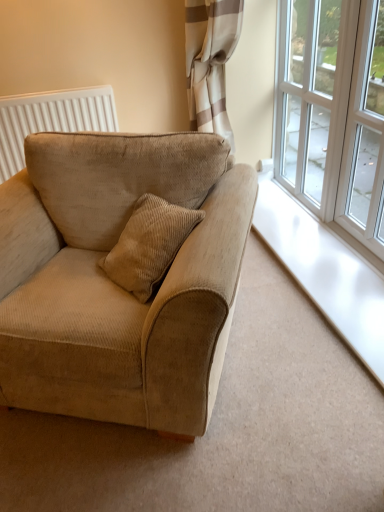
Question: Does beige corduroy couch at left have a greater width compared to clear glass window at upper right, which is the 1th window in front-to-back order?

Choices:
 (A) no
 (B) yes

Answer: (B)

Question: From a real-world perspective, does beige corduroy couch at left stand above clear glass window at upper right, which is counted as the 2th window, starting from the back?

Choices:
 (A) yes
 (B) no

Answer: (B)

Question: Can you confirm if beige corduroy couch at left is positioned to the right of clear glass window at upper right, which is the 1th window in front-to-back order?

Choices:
 (A) yes
 (B) no

Answer: (B)

Question: From a real-world perspective, is beige corduroy couch at left below clear glass window at upper right, which is counted as the 2th window, starting from the back?

Choices:
 (A) yes
 (B) no

Answer: (A)

Question: Is beige corduroy couch at left facing towards clear glass window at upper right, which is the 1th window in front-to-back order?

Choices:
 (A) no
 (B) yes

Answer: (A)

Question: Is beige corduroy couch at left positioned in front of clear glass window at upper right, which is counted as the 2th window, starting from the back?

Choices:
 (A) no
 (B) yes

Answer: (B)

Question: Can you confirm if clear glass window at upper right, which is the 1th window in front-to-back order, is positioned to the left of white textured radiator at upper left?

Choices:
 (A) yes
 (B) no

Answer: (B)

Question: Is clear glass window at upper right, which is the 1th window in front-to-back order, oriented away from white textured radiator at upper left?

Choices:
 (A) no
 (B) yes

Answer: (A)

Question: From the image's perspective, is clear glass window at upper right, which is the 1th window in front-to-back order, located above white textured radiator at upper left?

Choices:
 (A) no
 (B) yes

Answer: (A)

Question: Can you confirm if clear glass window at upper right, which is the 1th window in front-to-back order, is taller than white textured radiator at upper left?

Choices:
 (A) no
 (B) yes

Answer: (B)

Question: Is clear glass window at upper right, which is the 1th window in front-to-back order, wider than white textured radiator at upper left?

Choices:
 (A) no
 (B) yes

Answer: (A)

Question: Is clear glass window at upper right, which is counted as the 2th window, starting from the back, smaller than white textured radiator at upper left?

Choices:
 (A) yes
 (B) no

Answer: (B)

Question: Can you confirm if clear glass window at upper right, which is the 1th window in front-to-back order, is positioned to the right of white glass window at upper right, which is the second window from front to back?

Choices:
 (A) no
 (B) yes

Answer: (B)